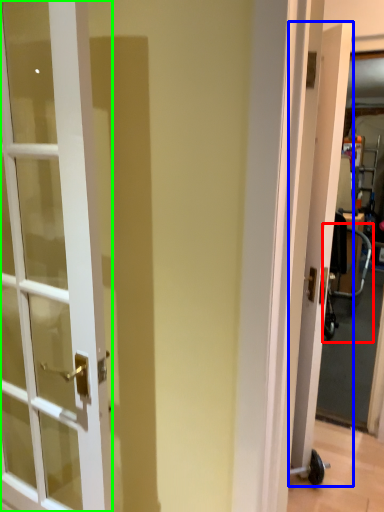
Question: Based on their relative distances, which object is farther from baby carriage (highlighted by a red box)? Choose from door (highlighted by a blue box) and door (highlighted by a green box).

Choices:
 (A) door
 (B) door

Answer: (B)